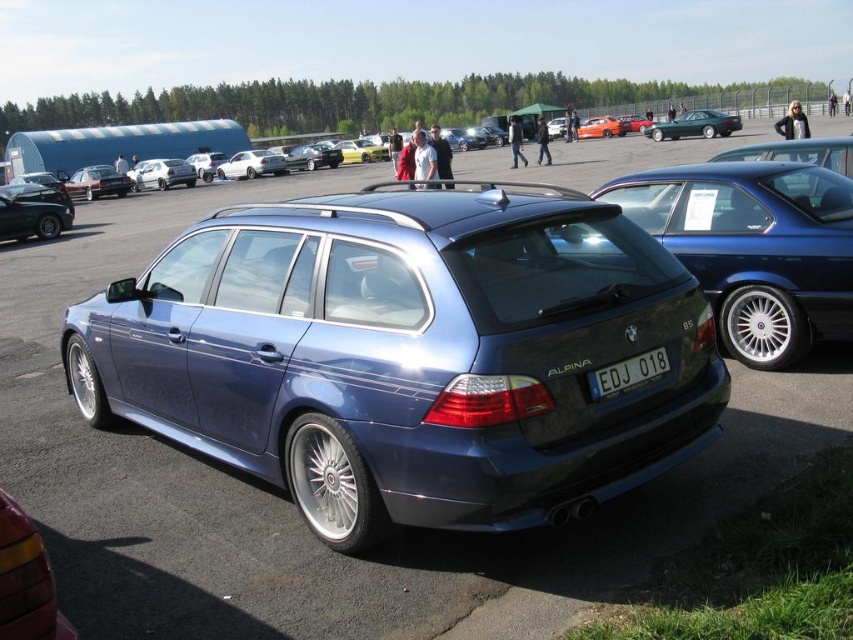
Does satin blue wagon at center appear over white plastic license plate at center?

Correct, satin blue wagon at center is located above white plastic license plate at center.

What do you see at coordinates (753, 248) in the screenshot? I see `satin blue wagon at center` at bounding box center [753, 248].

At what (x,y) coordinates should I click in order to perform the action: click on satin blue wagon at center. Please return your answer as a coordinate pair (x, y). Looking at the image, I should click on pyautogui.click(x=753, y=248).

This screenshot has height=640, width=853. What do you see at coordinates (753, 248) in the screenshot? I see `satin blue wagon at center` at bounding box center [753, 248].

Can you confirm if satin blue wagon at center is smaller than metallic green sedan at center?

Indeed, satin blue wagon at center has a smaller size compared to metallic green sedan at center.

Image resolution: width=853 pixels, height=640 pixels. What do you see at coordinates (753, 248) in the screenshot?
I see `satin blue wagon at center` at bounding box center [753, 248].

Identify the location of satin blue wagon at center. This screenshot has height=640, width=853. (753, 248).

Is white plastic license plate at center to the left of metallic green sedan at center from the viewer's perspective?

Yes, white plastic license plate at center is to the left of metallic green sedan at center.

Between white plastic license plate at center and metallic green sedan at center, which one has more height?

Standing taller between the two is metallic green sedan at center.

Which is in front, point (645, 355) or point (645, 128)?

Point (645, 355) is more forward.

Identify the location of white plastic license plate at center. The image size is (853, 640). (628, 372).